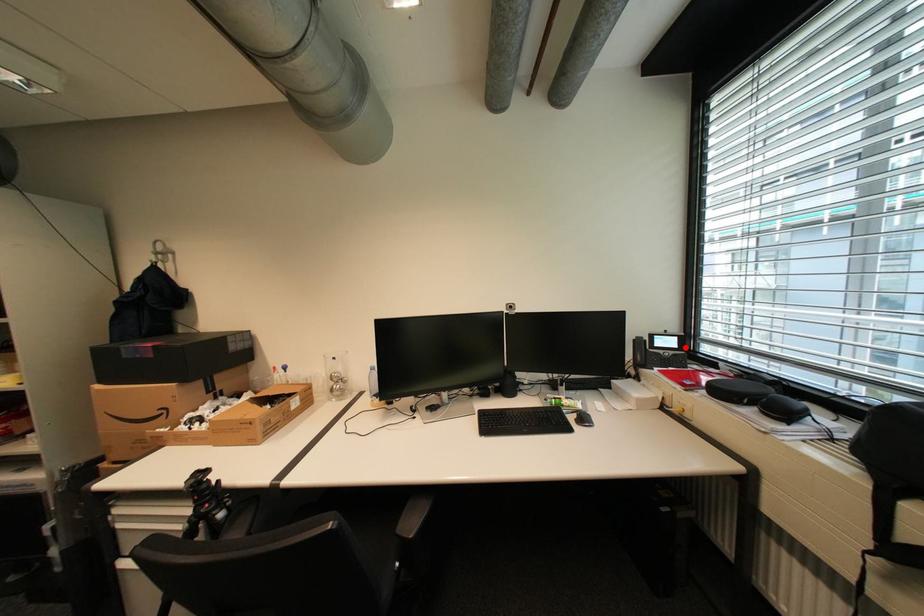
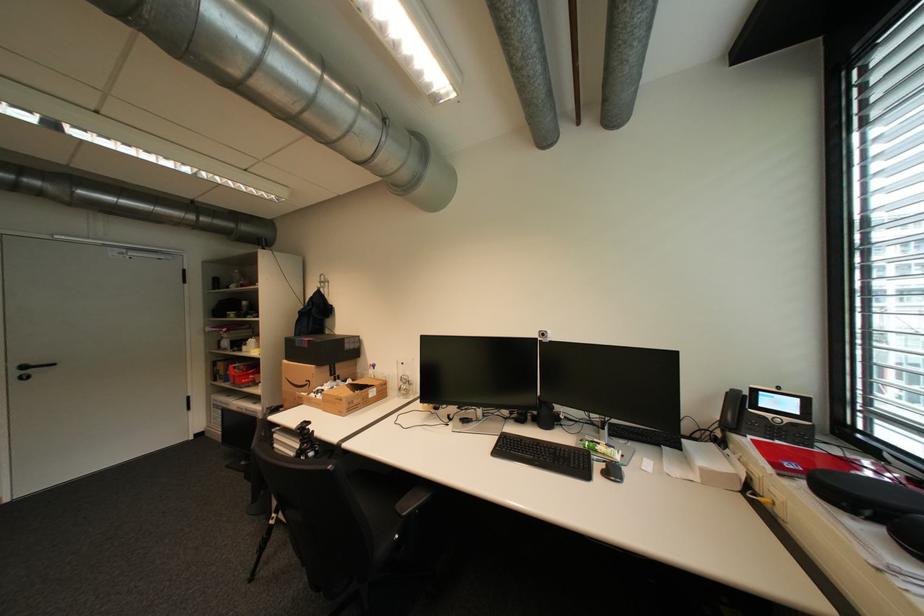
The point at the highlighted location is marked in the first image. Where is the corresponding point in the second image?

(806, 413)